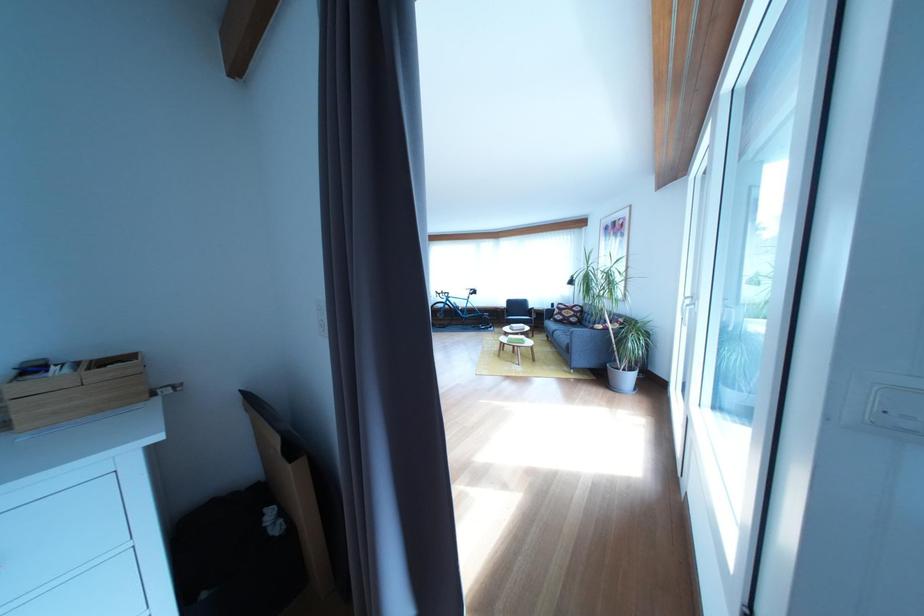
Find the location of a particular element. chair armrest is located at coordinates (588, 346).